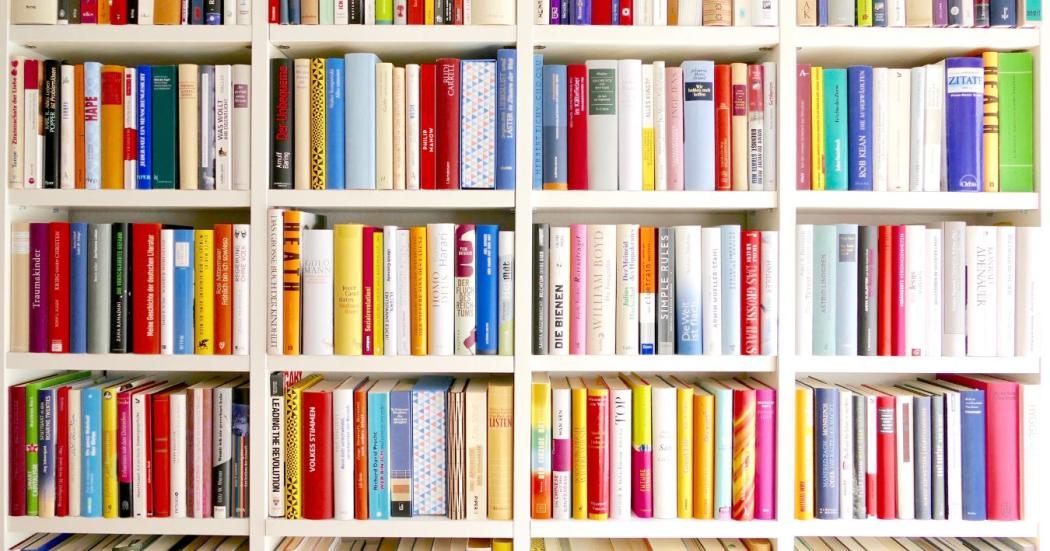
Locate an element on the screen. This screenshot has width=1050, height=551. top shelve is located at coordinates (172, 33), (343, 35), (632, 34), (904, 42).